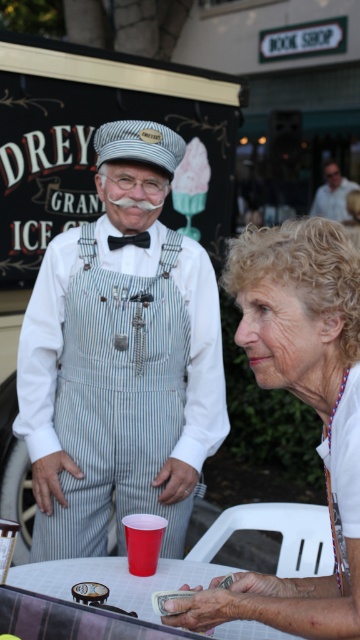
In the scene shown: Between white fabric shirt at center and smooth brown leather wallet at center, which one has more height?

A: Standing taller between the two is white fabric shirt at center.

I want to click on white fabric shirt at center, so click(x=304, y=401).

I want to click on white fabric shirt at center, so click(304, 401).

Where is `white plastic table at lower center`? This screenshot has height=640, width=360. white plastic table at lower center is located at coordinates (114, 579).

Identify the location of white plastic table at lower center. The width and height of the screenshot is (360, 640). (114, 579).

Who is taller, striped cotton overalls at center or white fabric shirt at center?

striped cotton overalls at center

Who is more forward, (x=96, y=150) or (x=322, y=416)?

Point (x=322, y=416)

Where is `striped cotton overalls at center`? This screenshot has height=640, width=360. striped cotton overalls at center is located at coordinates (120, 358).